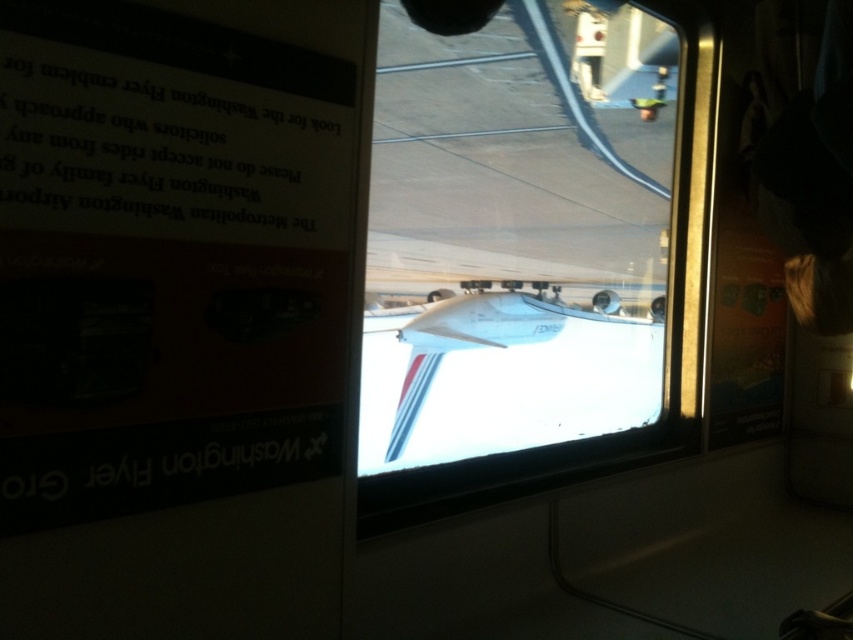
Which is more to the right, transparent glass airplane window at center or white glossy airplane at center?

Positioned to the right is white glossy airplane at center.

Looking at this image, between transparent glass airplane window at center and white glossy airplane at center, which one is positioned lower?

white glossy airplane at center is lower down.

The image size is (853, 640). What are the coordinates of `transparent glass airplane window at center` in the screenshot? It's located at (523, 257).